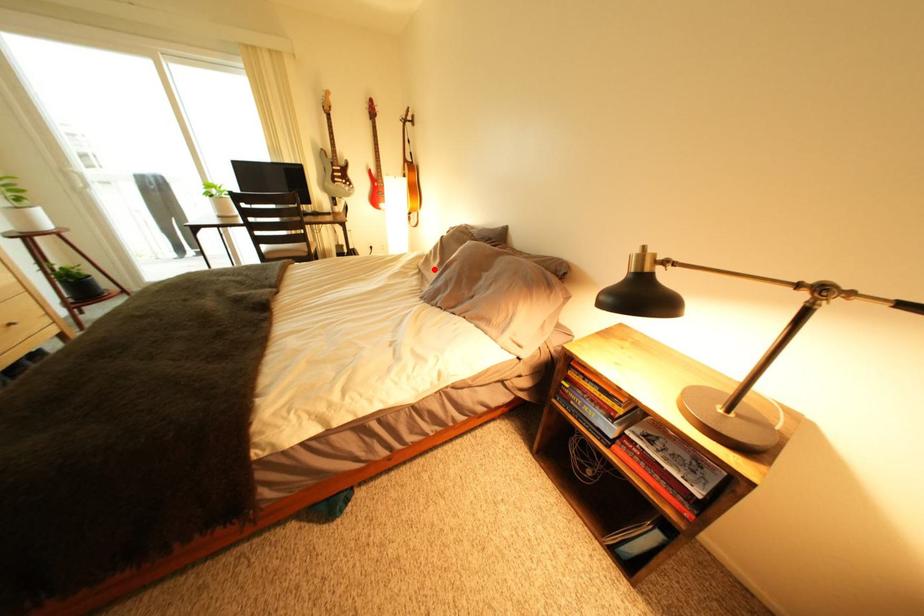
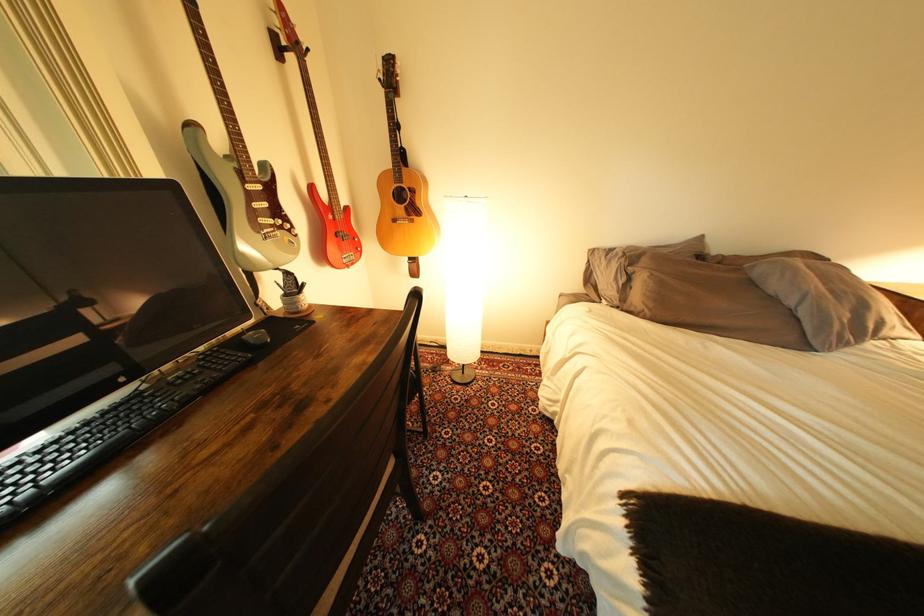
Question: I am providing you with two images of the same scene from different viewpoints. In image1, a red point is highlighted. Considering the same 3D point in image2, which of the following is correct?

Choices:
 (A) It is closer
 (B) It is farther

Answer: (A)